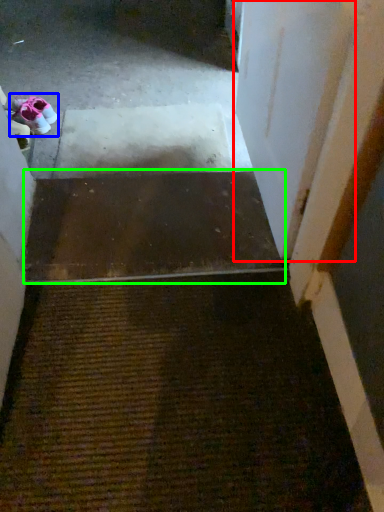
Question: Estimate the real-world distances between objects in this image. Which object is farther from door (highlighted by a red box), footwear (highlighted by a blue box) or stairs (highlighted by a green box)?

Choices:
 (A) footwear
 (B) stairs

Answer: (A)